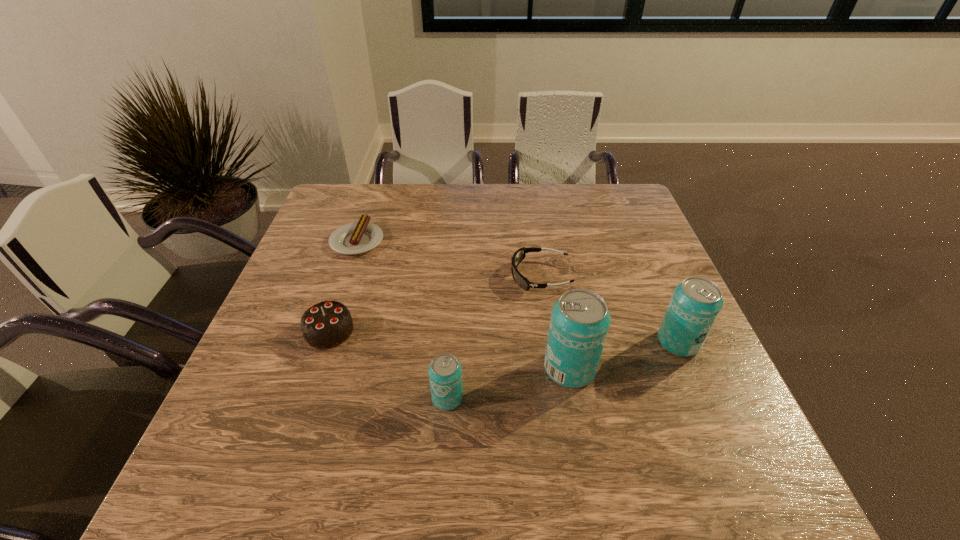
Find the location of a particular element. Image resolution: width=960 pixels, height=540 pixels. object located in the right edge section of the desktop is located at coordinates (695, 304).

The height and width of the screenshot is (540, 960). I want to click on object present at the far left corner, so click(358, 237).

In order to click on vacant space at the far edge of the desktop in this screenshot , I will do `click(395, 204)`.

You are a GUI agent. You are given a task and a screenshot of the screen. Output one action in this format:
    pyautogui.click(x=<x>, y=<y>)
    Task: Click on the vacant space at the near edge
    
    Given the screenshot: What is the action you would take?
    pyautogui.click(x=579, y=415)

The image size is (960, 540). What are the coordinates of `vacant space at the left edge` in the screenshot? It's located at (325, 274).

Find the location of a particular element. vacant area at the right edge of the desktop is located at coordinates tap(638, 232).

At what (x,y) coordinates should I click in order to perform the action: click on vacant area at the far left corner of the desktop. Please return your answer as a coordinate pair (x, y). The height and width of the screenshot is (540, 960). Looking at the image, I should click on (362, 205).

Find the location of a particular element. This screenshot has height=540, width=960. vacant space at the near left corner is located at coordinates (285, 401).

Image resolution: width=960 pixels, height=540 pixels. I want to click on free location at the far right corner, so click(x=630, y=202).

In the image, there is a desktop. Where is `vacant area at the near right corner`? This screenshot has width=960, height=540. vacant area at the near right corner is located at coordinates (681, 423).